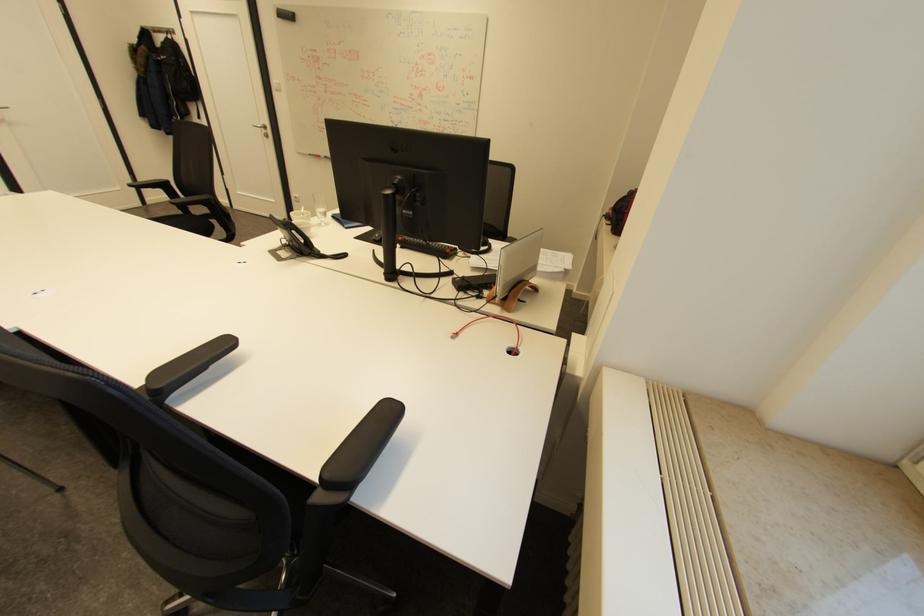
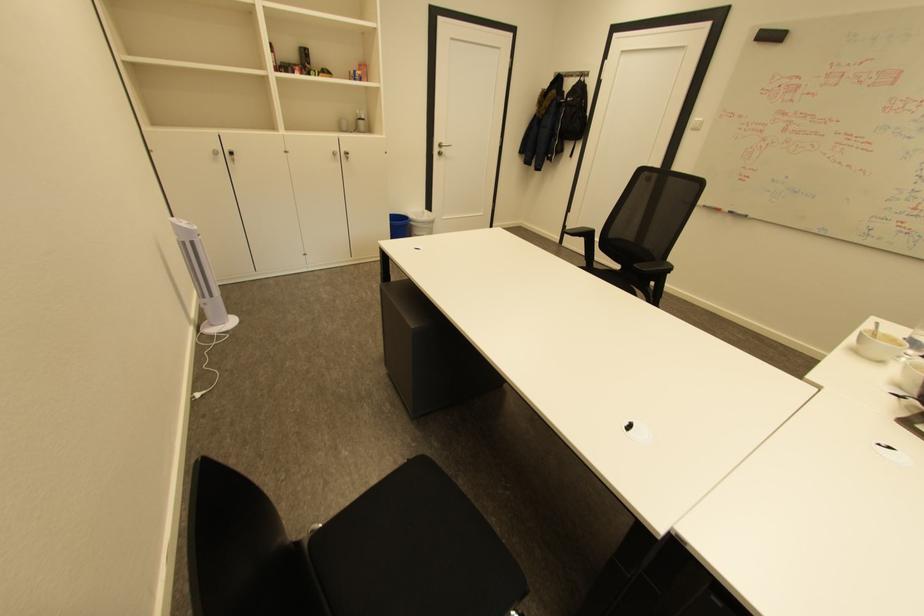
In the second image, find the point that corresponds to point (333, 156) in the first image.

(737, 212)